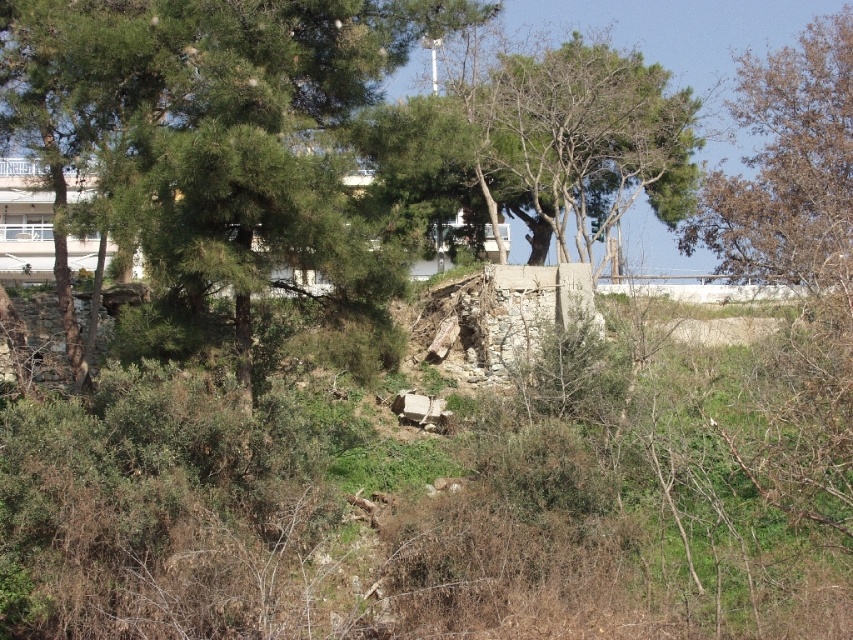
The height and width of the screenshot is (640, 853). Describe the element at coordinates (213, 125) in the screenshot. I see `green leafy tree at center` at that location.

Does green leafy tree at center appear on the right side of brown leafy tree at upper right?

In fact, green leafy tree at center is to the left of brown leafy tree at upper right.

The height and width of the screenshot is (640, 853). I want to click on green leafy tree at center, so click(x=213, y=125).